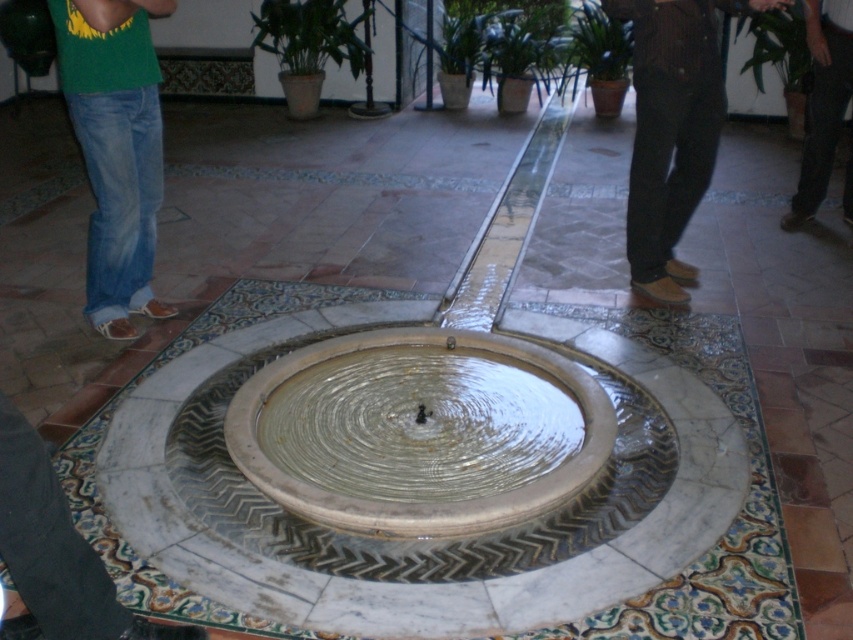
Is brown suede shoes at lower right bigger than dark brown leather shoes at lower right?

Indeed, brown suede shoes at lower right has a larger size compared to dark brown leather shoes at lower right.

Does brown suede shoes at lower right appear over dark brown leather shoes at lower right?

Actually, brown suede shoes at lower right is below dark brown leather shoes at lower right.

I want to click on brown suede shoes at lower right, so click(672, 129).

Can you confirm if clear glass water at center is positioned to the left of dark brown leather shoes at lower right?

Correct, you'll find clear glass water at center to the left of dark brown leather shoes at lower right.

Does clear glass water at center appear on the right side of dark brown leather shoes at lower right?

No, clear glass water at center is not to the right of dark brown leather shoes at lower right.

Which is in front, point (442, 451) or point (817, 13)?

Point (442, 451)

Find the location of a particular element. clear glass water at center is located at coordinates (419, 429).

Which is in front, point (111, 92) or point (851, 157)?

Point (111, 92)

Is denim jeans at left to the left of dark brown leather shoes at lower right from the viewer's perspective?

Correct, you'll find denim jeans at left to the left of dark brown leather shoes at lower right.

Locate an element on the screen. This screenshot has width=853, height=640. denim jeans at left is located at coordinates (115, 147).

Locate an element on the screen. This screenshot has height=640, width=853. denim jeans at left is located at coordinates (115, 147).